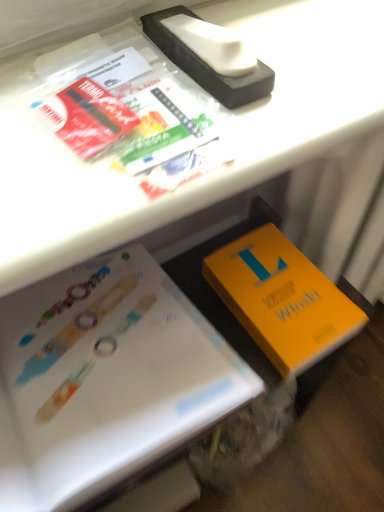
At what (x,y) coordinates should I click in order to perform the action: click on blank space above white paper at lower left, which appears as the 2th book when viewed from the right (from a real-world perspective). Please return your answer as a coordinate pair (x, y). The image size is (384, 512). Looking at the image, I should click on (79, 333).